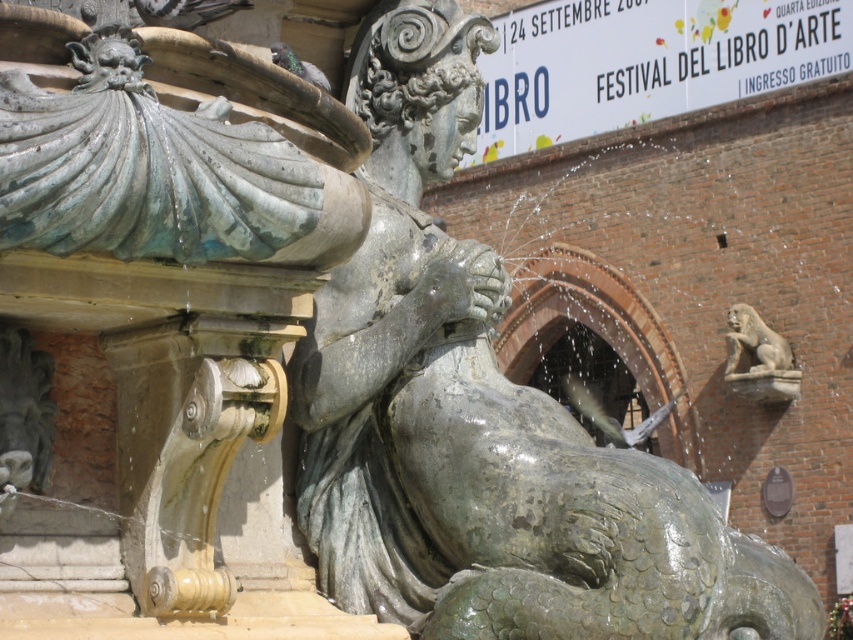
Is gray stone lion at upper right above gray matte pigeon at upper left?

No.

Is gray stone lion at upper right smaller than gray matte pigeon at upper left?

Incorrect, gray stone lion at upper right is not smaller in size than gray matte pigeon at upper left.

Who is more distant from viewer, (734, 328) or (322, 83)?

Positioned behind is point (734, 328).

This screenshot has width=853, height=640. What are the coordinates of `gray stone lion at upper right` in the screenshot? It's located at (753, 342).

What do you see at coordinates (186, 12) in the screenshot?
I see `gray feathered pigeon at upper left` at bounding box center [186, 12].

Looking at this image, who is positioned more to the left, gray feathered pigeon at upper left or gray matte pigeon at upper left?

From the viewer's perspective, gray feathered pigeon at upper left appears more on the left side.

What are the coordinates of `gray feathered pigeon at upper left` in the screenshot? It's located at [186, 12].

Does gray stone lion at upper right appear on the left side of gray feathered pigeon at upper left?

No, gray stone lion at upper right is not to the left of gray feathered pigeon at upper left.

How distant is gray stone lion at upper right from gray feathered pigeon at upper left?

A distance of 179.88 feet exists between gray stone lion at upper right and gray feathered pigeon at upper left.

Between point (740, 349) and point (141, 3), which one is positioned behind?

Point (740, 349)

At what (x,y) coordinates should I click in order to perform the action: click on gray stone lion at upper right. Please return your answer as a coordinate pair (x, y). The height and width of the screenshot is (640, 853). Looking at the image, I should click on (753, 342).